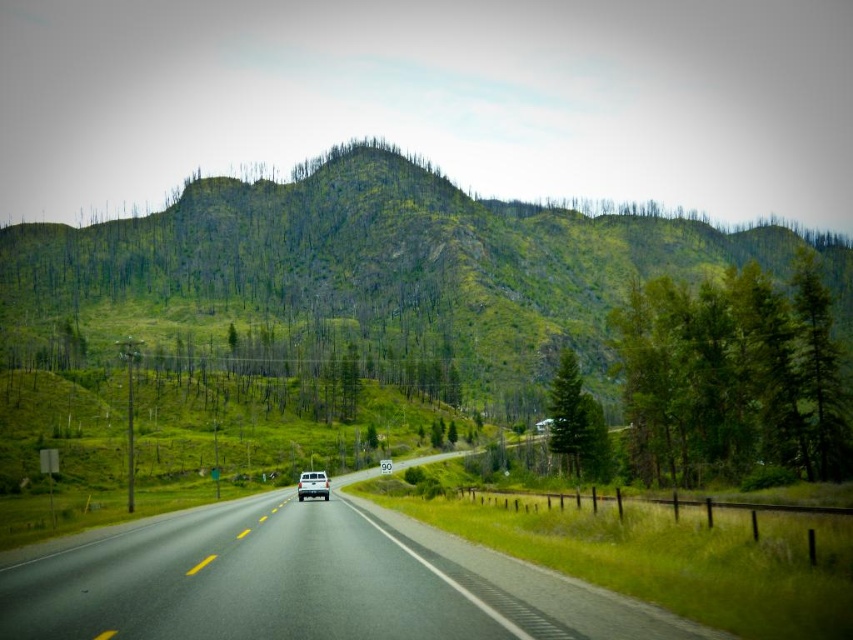
Question: Which point is farther to the camera?

Choices:
 (A) black asphalt road at center
 (B) white matte truck at center

Answer: (B)

Question: Can you confirm if green textured hillside at upper center is wider than white matte truck at center?

Choices:
 (A) no
 (B) yes

Answer: (B)

Question: Which of the following is the closest to the observer?

Choices:
 (A) (39, 298)
 (B) (572, 403)

Answer: (B)

Question: Which object is farther from the camera taking this photo?

Choices:
 (A) black asphalt road at center
 (B) white matte truck at center

Answer: (B)

Question: Is green matte tree at right bigger than white matte truck at center?

Choices:
 (A) no
 (B) yes

Answer: (B)

Question: In this image, where is black asphalt road at center located relative to green matte tree at right?

Choices:
 (A) left
 (B) right

Answer: (A)